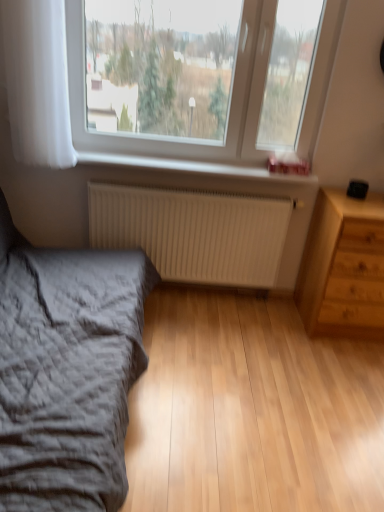
Find the location of a particular element. The width and height of the screenshot is (384, 512). light brown wood chest of drawers at right is located at coordinates (343, 267).

At what (x,y) coordinates should I click in order to perform the action: click on gray textured bed at lower left. Please return your answer as a coordinate pair (x, y). Looking at the image, I should click on (67, 371).

What do you see at coordinates (230, 104) in the screenshot?
I see `transparent glass window at upper center` at bounding box center [230, 104].

This screenshot has height=512, width=384. In order to click on white plastic radiator at lower center in this screenshot , I will do `click(192, 167)`.

Does gray textured bed at lower left appear on the right side of white matte radiator at lower center?

In fact, gray textured bed at lower left is to the left of white matte radiator at lower center.

What's the angular difference between gray textured bed at lower left and white matte radiator at lower center's facing directions?

90.8 degrees separate the facing orientations of gray textured bed at lower left and white matte radiator at lower center.

Is white matte radiator at lower center at the back of gray textured bed at lower left?

No, gray textured bed at lower left's orientation is not away from white matte radiator at lower center.

Considering the relative sizes of gray textured bed at lower left and white matte radiator at lower center in the image provided, is gray textured bed at lower left thinner than white matte radiator at lower center?

Incorrect, the width of gray textured bed at lower left is not less than that of white matte radiator at lower center.

Is white sheer curtain at left further to the viewer compared to transparent glass window at upper center?

No, it is not.

The width and height of the screenshot is (384, 512). Find the location of `curtain that appears below the transparent glass window at upper center (from the image's perspective)`. curtain that appears below the transparent glass window at upper center (from the image's perspective) is located at coordinates (38, 82).

Is white sheer curtain at left not inside transparent glass window at upper center?

Absolutely, white sheer curtain at left is external to transparent glass window at upper center.

Visually, is white sheer curtain at left positioned to the left or to the right of transparent glass window at upper center?

From the image, it's evident that white sheer curtain at left is to the left of transparent glass window at upper center.

Would you say white plastic radiator at lower center is outside light brown wood chest of drawers at right?

white plastic radiator at lower center is positioned outside light brown wood chest of drawers at right.

From the image's perspective, is white plastic radiator at lower center under light brown wood chest of drawers at right?

Actually, white plastic radiator at lower center appears above light brown wood chest of drawers at right in the image.

Is white plastic radiator at lower center further to camera compared to light brown wood chest of drawers at right?

Yes, it is behind light brown wood chest of drawers at right.

Does white plastic radiator at lower center have a smaller size compared to light brown wood chest of drawers at right?

Yes.

Is white sheer curtain at left inside or outside of light brown wood chest of drawers at right?

white sheer curtain at left is not enclosed by light brown wood chest of drawers at right.

Considering the relative positions of white sheer curtain at left and light brown wood chest of drawers at right in the image provided, is white sheer curtain at left to the left or to the right of light brown wood chest of drawers at right?

In the image, white sheer curtain at left appears on the left side of light brown wood chest of drawers at right.

Considering their positions, is white sheer curtain at left located in front of or behind light brown wood chest of drawers at right?

white sheer curtain at left is positioned closer to the viewer than light brown wood chest of drawers at right.

Is point (44, 100) closer to camera compared to point (367, 242)?

Yes, it is in front of point (367, 242).

Considering the relative positions of transparent glass window at upper center and light brown wood chest of drawers at right in the image provided, is transparent glass window at upper center in front of light brown wood chest of drawers at right?

Yes, transparent glass window at upper center is closer to the camera.

Looking at this image, are transparent glass window at upper center and light brown wood chest of drawers at right far apart?

No, transparent glass window at upper center is not far away from light brown wood chest of drawers at right.

Between transparent glass window at upper center and light brown wood chest of drawers at right, which one has less height?

With less height is light brown wood chest of drawers at right.

Which is nearer, (80,140) or (357,334)?

The point (80,140) is closer.

From a real-world perspective, which object rests below the other?

In real-world perspective, white matte radiator at lower center is lower.

Considering the sizes of objects transparent glass window at upper center and white matte radiator at lower center in the image provided, who is bigger, transparent glass window at upper center or white matte radiator at lower center?

Bigger between the two is transparent glass window at upper center.

Considering the relative positions of transparent glass window at upper center and white matte radiator at lower center in the image provided, is transparent glass window at upper center to the right of white matte radiator at lower center from the viewer's perspective?

Yes.

Is point (71, 6) closer to camera compared to point (292, 208)?

Yes, point (71, 6) is in front of point (292, 208).

What's the angular difference between white matte radiator at lower center and light brown wood chest of drawers at right's facing directions?

They differ by 0.436 degrees in their facing directions.

Measure the distance from white matte radiator at lower center to light brown wood chest of drawers at right.

white matte radiator at lower center is 24.08 inches away from light brown wood chest of drawers at right.

Considering the relative sizes of white matte radiator at lower center and light brown wood chest of drawers at right in the image provided, is white matte radiator at lower center wider than light brown wood chest of drawers at right?

In fact, white matte radiator at lower center might be narrower than light brown wood chest of drawers at right.

Is light brown wood chest of drawers at right inside white matte radiator at lower center?

No, light brown wood chest of drawers at right is located outside of white matte radiator at lower center.

I want to click on radiator lying behind the gray textured bed at lower left, so click(x=193, y=232).

This screenshot has height=512, width=384. I want to click on curtain to the left of transparent glass window at upper center, so click(x=38, y=82).

Based on their spatial positions, is gray textured bed at lower left or white matte radiator at lower center further from white sheer curtain at left?

gray textured bed at lower left is positioned further to the anchor white sheer curtain at left.

Based on the photo, estimate the real-world distances between objects in this image. Which object is further from white sheer curtain at left, transparent glass window at upper center or white matte radiator at lower center?

white matte radiator at lower center is further to white sheer curtain at left.

When comparing their distances from white sheer curtain at left, does transparent glass window at upper center or light brown wood chest of drawers at right seem further?

light brown wood chest of drawers at right is further to white sheer curtain at left.

Considering their positions, is light brown wood chest of drawers at right positioned closer to transparent glass window at upper center than gray textured bed at lower left?

Based on the image, light brown wood chest of drawers at right appears to be nearer to transparent glass window at upper center.

Based on their spatial positions, is white sheer curtain at left or white matte radiator at lower center further from transparent glass window at upper center?

The object further to transparent glass window at upper center is white matte radiator at lower center.

Looking at the image, which one is located closer to white matte radiator at lower center, light brown wood chest of drawers at right or white sheer curtain at left?

Based on the image, light brown wood chest of drawers at right appears to be nearer to white matte radiator at lower center.

Which object lies further to the anchor point gray textured bed at lower left, white matte radiator at lower center or white plastic radiator at lower center?

white plastic radiator at lower center is further to gray textured bed at lower left.

Looking at the image, which one is located further to light brown wood chest of drawers at right, white sheer curtain at left or white matte radiator at lower center?

The object further to light brown wood chest of drawers at right is white sheer curtain at left.

What are the coordinates of `window located between gray textured bed at lower left and light brown wood chest of drawers at right in the depth direction` in the screenshot? It's located at (230, 104).

Identify the location of the chest of drawers located between gray textured bed at lower left and white plastic radiator at lower center in the depth direction. (343, 267).

Find the location of a particular element. Image resolution: width=384 pixels, height=512 pixels. window between white sheer curtain at left and light brown wood chest of drawers at right in the horizontal direction is located at coordinates (230, 104).

The width and height of the screenshot is (384, 512). In order to click on window between white plastic radiator at lower center and light brown wood chest of drawers at right in the horizontal direction in this screenshot , I will do `click(230, 104)`.